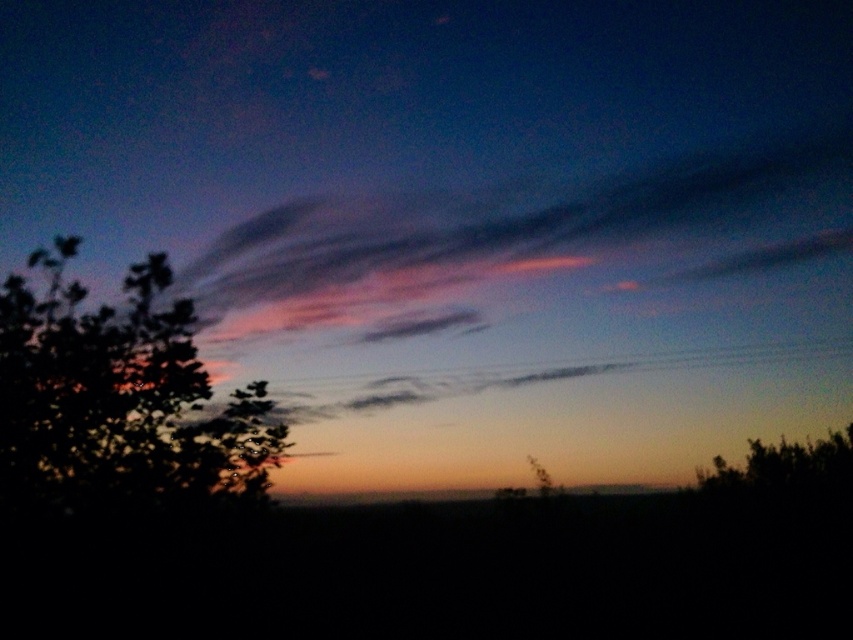
Is green leafy tree at left below smooth dark ground at center?

No, green leafy tree at left is not below smooth dark ground at center.

Where is `green leafy tree at left`? The image size is (853, 640). green leafy tree at left is located at coordinates (119, 403).

The image size is (853, 640). What do you see at coordinates (119, 403) in the screenshot? I see `green leafy tree at left` at bounding box center [119, 403].

Where is `green leafy tree at left`? This screenshot has width=853, height=640. green leafy tree at left is located at coordinates (119, 403).

Does pink translucent clouds at upper center have a lesser height compared to green leafy tree at left?

Incorrect, pink translucent clouds at upper center's height does not fall short of green leafy tree at left's.

Is point (456, 273) positioned in front of point (80, 324)?

No.

Identify the location of pink translucent clouds at upper center. This screenshot has width=853, height=640. (517, 243).

Find the location of a particular element. pink translucent clouds at upper center is located at coordinates (517, 243).

Is pink translucent clouds at upper center above smooth dark ground at center?

Yes, pink translucent clouds at upper center is above smooth dark ground at center.

Identify the location of pink translucent clouds at upper center. (517, 243).